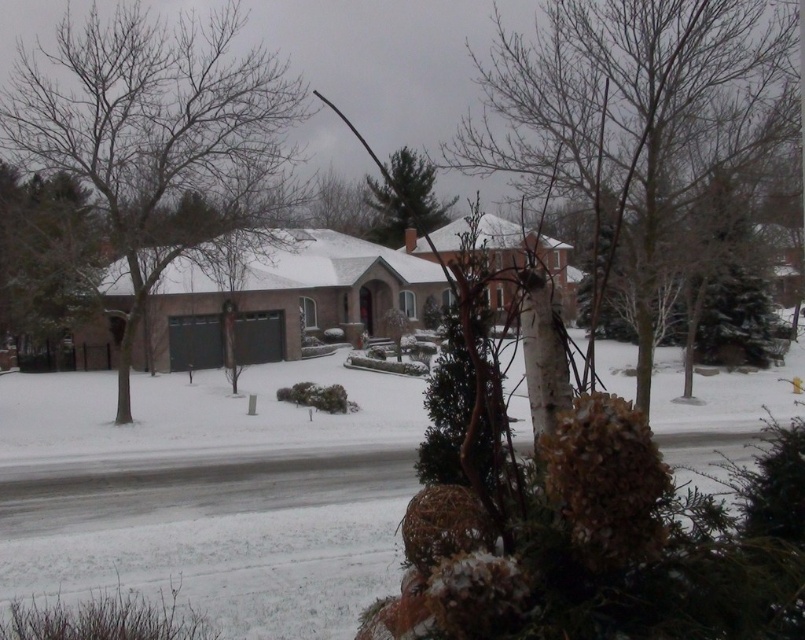
Which is below, green textured evergreen tree at upper left or green matte tree at center?

green textured evergreen tree at upper left is lower down.

Does green textured evergreen tree at upper left have a smaller size compared to green matte tree at center?

Yes, green textured evergreen tree at upper left is smaller than green matte tree at center.

Is point (23, 320) more distant than point (420, 176)?

No.

Where is `green textured evergreen tree at upper left`? The width and height of the screenshot is (805, 640). green textured evergreen tree at upper left is located at coordinates (46, 266).

Which is more to the right, bare wood tree at center or green matte tree at center?

Positioned to the right is bare wood tree at center.

Image resolution: width=805 pixels, height=640 pixels. I want to click on bare wood tree at center, so click(630, 115).

Does point (646, 282) lie behind point (142, 160)?

No, (646, 282) is in front of (142, 160).

Can you confirm if bare wood tree at center is taller than brown leafless tree at left?

Indeed, bare wood tree at center has a greater height compared to brown leafless tree at left.

Which is in front, point (572, 106) or point (81, 157)?

Point (572, 106) is in front.

What are the coordinates of `bare wood tree at center` in the screenshot? It's located at (630, 115).